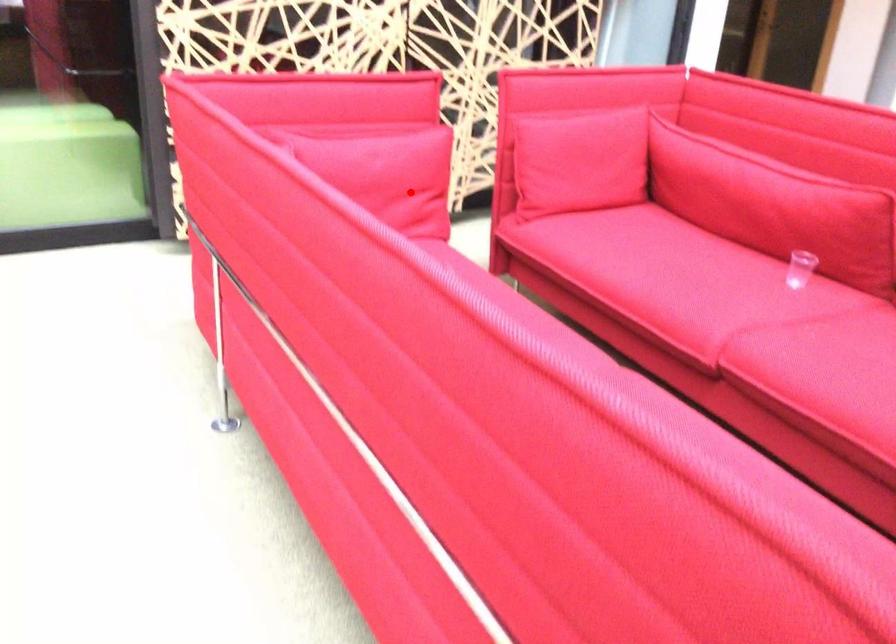
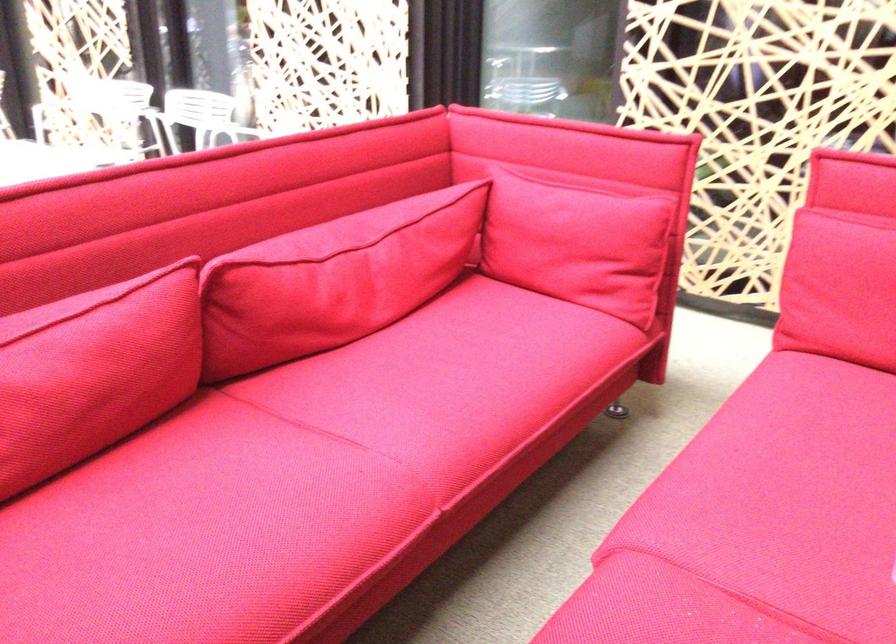
Question: I am providing you with two images of the same scene from different viewpoints. In image1, a red point is highlighted. Considering the same 3D point in image2, which of the following is correct?

Choices:
 (A) It is closer
 (B) It is farther

Answer: (A)